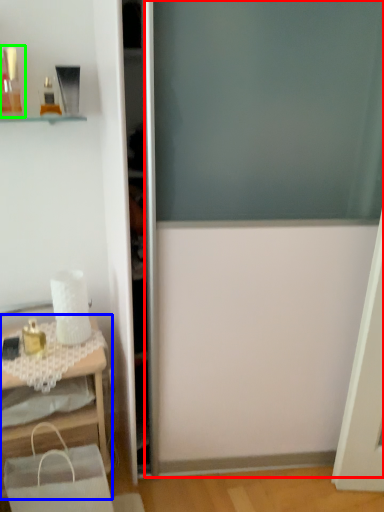
Question: Estimate the real-world distances between objects in this image. Which object is farther from screen door (highlighted by a red box), table (highlighted by a blue box) or toiletry (highlighted by a green box)?

Choices:
 (A) table
 (B) toiletry

Answer: (B)